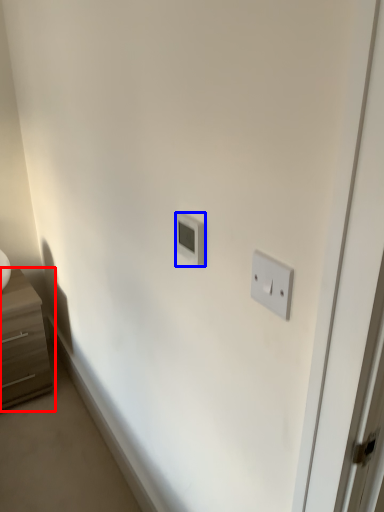
Question: Which point is further to the camera, chest of drawers (highlighted by a red box) or light switch (highlighted by a blue box)?

Choices:
 (A) chest of drawers
 (B) light switch

Answer: (A)